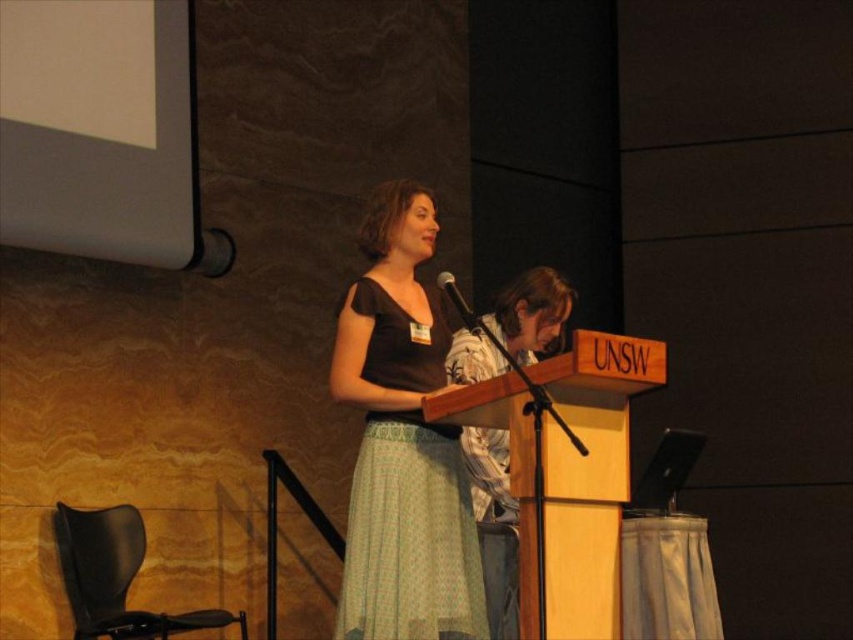
You are sitting in the audience and notice two points marked on the floor. The first point is at coordinates point [397,429], and the second point is at point [473,310]. Which point is closer to the speaker at the UNSW podium?

Point [397,429] is in front of point [473,310], so it is closer to the speaker at the UNSW podium.

Based on the description, can you determine if the matte black dress at center is wider than the patterned fabric shirt at center?

The matte black dress at center is wider than the patterned fabric shirt at center according to the description.